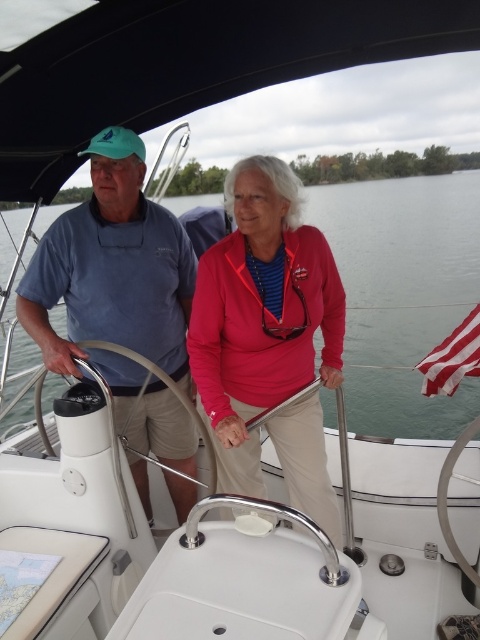
You are a photographer on the boat and want to take a photo of both the matte blue shirt at center and the striped fabric flag at right. Which object should you focus on first to ensure both are in sharp focus?

The matte blue shirt at center is closer to the viewer than the striped fabric flag at right. To ensure both are in sharp focus, you should focus on the matte blue shirt at center first, as it is the closer object.

Based on the photo, you are a photographer trying to capture a photo of the matte red jacket at center and the clear water at center. Which object is closer to the camera based on their sizes?

The matte red jacket at center is closer to the camera because it appears larger than the clear water at center, which is smaller and farther away.

You are observing two people on a boat. The person wearing the matte red jacket at center and the person wearing the matte blue shirt at center are both standing. Which clothing item is shorter in height?

The matte red jacket at center is shorter than the matte blue shirt at center.